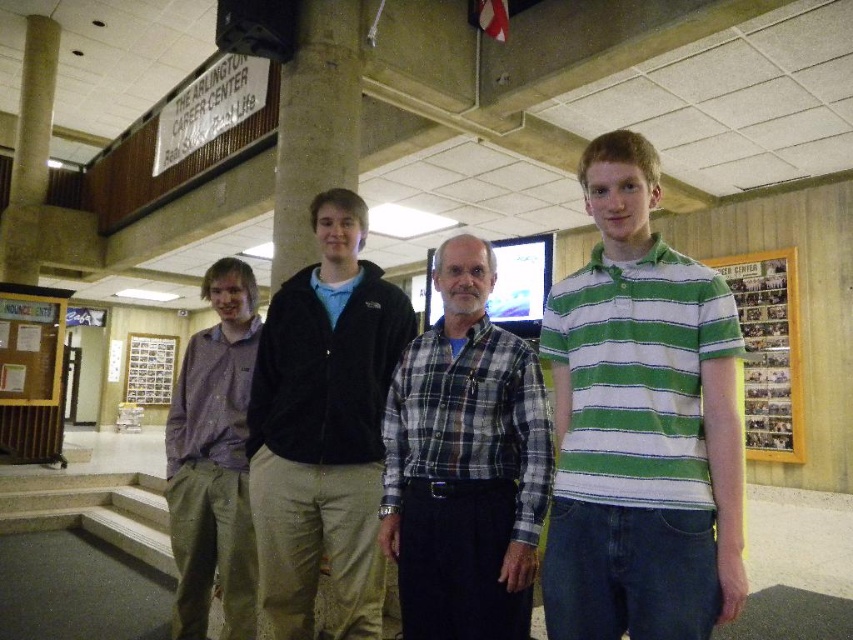
Which is more to the left, velvet black jacket at center or wooden bulletin board at left?

wooden bulletin board at left is more to the left.

Who is higher up, velvet black jacket at center or wooden bulletin board at left?

velvet black jacket at center is higher up.

Identify the location of velvet black jacket at center. (323, 428).

How far apart are green striped polo shirt at center and purple cotton shirt at left?

green striped polo shirt at center is 1.57 meters from purple cotton shirt at left.

Is green striped polo shirt at center closer to camera compared to purple cotton shirt at left?

Yes, green striped polo shirt at center is in front of purple cotton shirt at left.

Who is more distant from viewer, [578,280] or [167,492]?

The point [167,492] is more distant.

This screenshot has height=640, width=853. I want to click on green striped polo shirt at center, so click(640, 422).

Between point (596, 438) and point (453, 241), which one is positioned behind?

Point (453, 241)

Can you confirm if green striped polo shirt at center is thinner than plaid shirt at center?

Correct, green striped polo shirt at center's width is less than plaid shirt at center's.

Measure the distance between point (625, 516) and camera.

Point (625, 516) and camera are 1.45 meters apart from each other.

Where is `green striped polo shirt at center`? The height and width of the screenshot is (640, 853). green striped polo shirt at center is located at coordinates (640, 422).